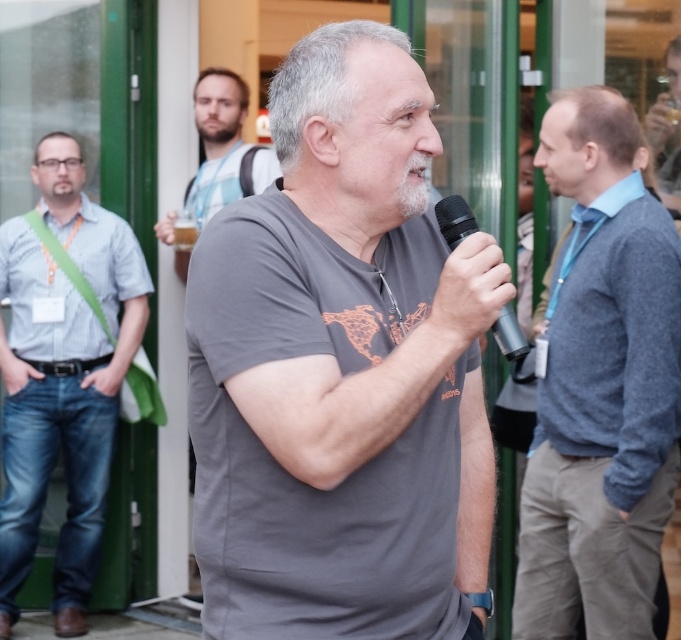
In the scene shown: You are a photographer at this event and want to take a photo of the gray wool sweater at center and the black metallic microphone at center. Which object will appear larger in the photo?

The gray wool sweater at center will appear larger in the photo because it is closer to the viewer than the black metallic microphone at center.

In the scene shown: You are a photographer at the event and want to capture a photo that includes both the gray wool sweater at center and the beige striped shirt at upper center. Based on their positions, which one should you focus on first to ensure both are in frame?

The gray wool sweater at center is below the beige striped shirt at upper center, so you should focus on the beige striped shirt at upper center first to ensure both are in frame.